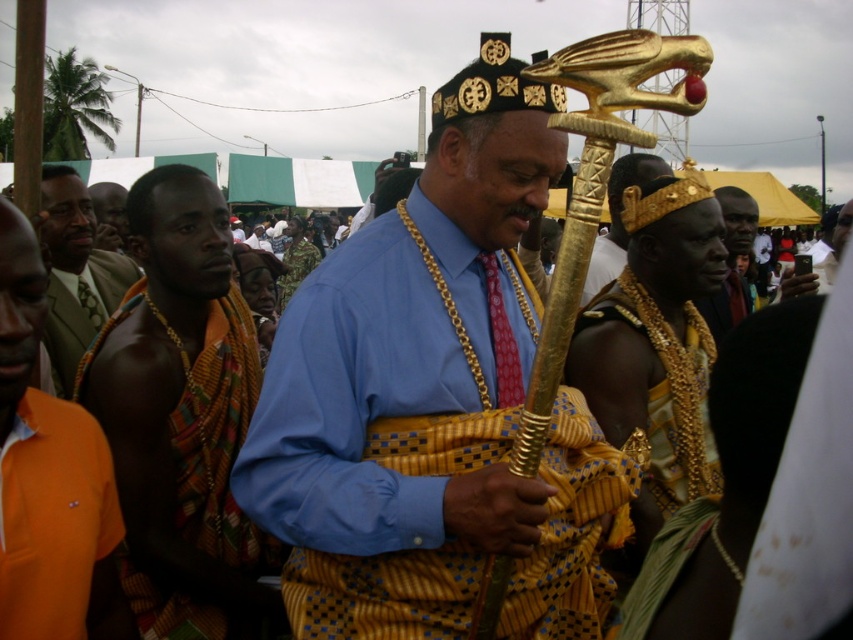
Question: Is gold textured staff at center smaller than textured fabric cloth at left?

Choices:
 (A) no
 (B) yes

Answer: (A)

Question: Estimate the real-world distances between objects in this image. Which object is closer to the orange woven cloth at left?

Choices:
 (A) gold textured staff at center
 (B) textured fabric cloth at left
 (C) orange fabric at left

Answer: (B)

Question: Considering the real-world distances, which object is farthest from the orange woven cloth at left?

Choices:
 (A) orange fabric at left
 (B) gold textured staff at center
 (C) textured fabric cloth at left

Answer: (B)

Question: Among these points, which one is nearest to the camera?

Choices:
 (A) (184, 403)
 (B) (61, 266)
 (C) (32, 614)

Answer: (C)

Question: Can you confirm if gold textured staff at center is positioned below orange fabric at left?

Choices:
 (A) no
 (B) yes

Answer: (A)

Question: Observing the image, what is the correct spatial positioning of orange fabric at left in reference to orange woven cloth at left?

Choices:
 (A) above
 (B) below

Answer: (B)